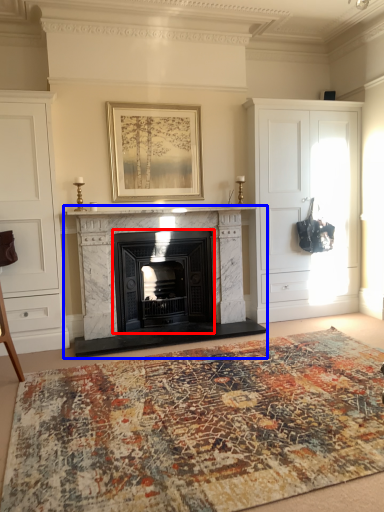
Question: Which object appears closest to the camera in this image, wood burning stove (highlighted by a red box) or fireplace (highlighted by a blue box)?

Choices:
 (A) wood burning stove
 (B) fireplace

Answer: (B)